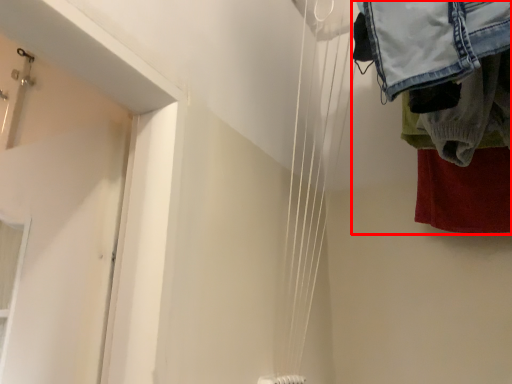
Question: From the image's perspective, where is laundry (annotated by the red box) located in relation to wire in the image?

Choices:
 (A) below
 (B) above

Answer: (B)